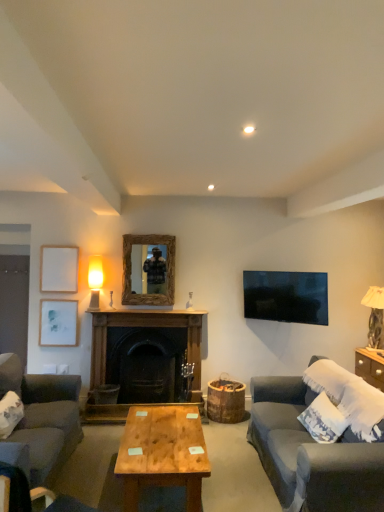
At what (x,y) coordinates should I click in order to perform the action: click on free point below wooden-framed mirror at center (from a real-world perspective). Please return your answer as a coordinate pair (x, y). The width and height of the screenshot is (384, 512). Looking at the image, I should click on (146, 310).